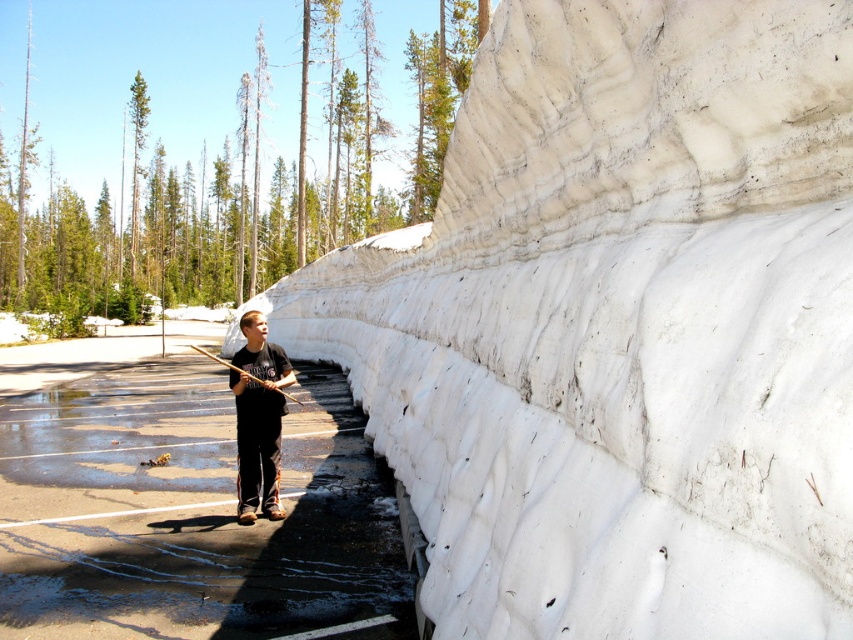
Between white fluffy snow at center and dark gray cotton shirt at center, which one has less height?

With less height is dark gray cotton shirt at center.

Which is below, white fluffy snow at center or dark gray cotton shirt at center?

dark gray cotton shirt at center is lower down.

What do you see at coordinates (619, 326) in the screenshot?
I see `white fluffy snow at center` at bounding box center [619, 326].

Locate an element on the screen. white fluffy snow at center is located at coordinates (619, 326).

Is white fluffy snow at center below wooden fishing pole at center?

No.

Is white fluffy snow at center to the right of wooden fishing pole at center from the viewer's perspective?

Yes, white fluffy snow at center is to the right of wooden fishing pole at center.

Who is more distant from viewer, [676,570] or [202,349]?

Positioned behind is point [202,349].

Locate an element on the screen. white fluffy snow at center is located at coordinates (619, 326).

Can you confirm if dark gray cotton shirt at center is positioned below wooden fishing pole at center?

Yes.

Where is `dark gray cotton shirt at center`? The image size is (853, 640). dark gray cotton shirt at center is located at coordinates (258, 417).

I want to click on dark gray cotton shirt at center, so click(258, 417).